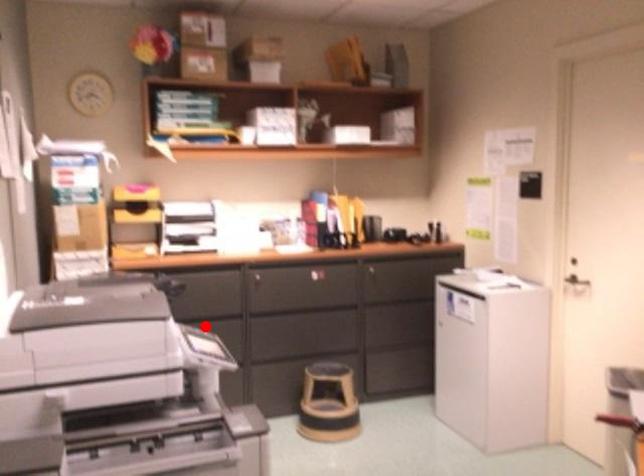
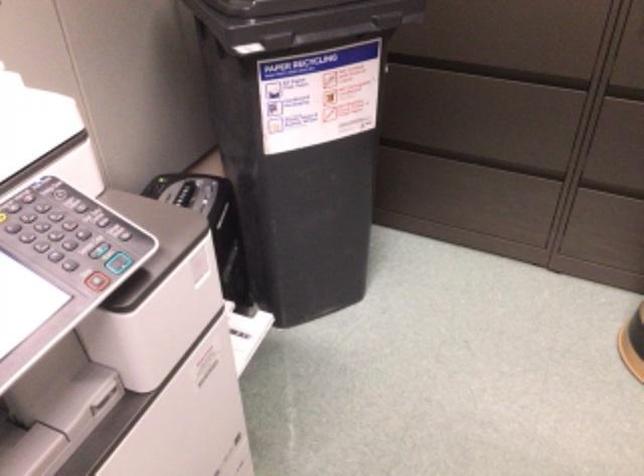
In the second image, find the point that corresponds to the highlighted location in the first image.

(507, 73)